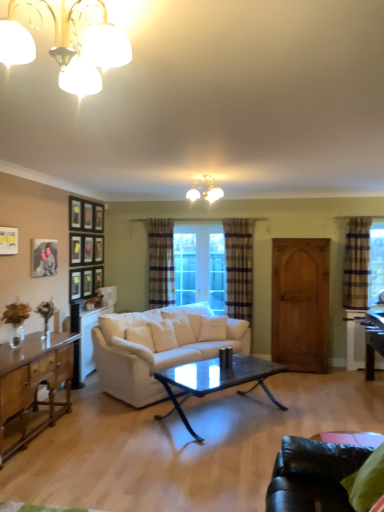
The width and height of the screenshot is (384, 512). What are the coordinates of `wooden cabinet at left` in the screenshot? It's located at click(34, 381).

What do you see at coordinates (300, 304) in the screenshot? I see `wooden armoire at right` at bounding box center [300, 304].

Based on the photo, how much space does matte black picture frame at upper left, which appears as the fourth picture frame when viewed from the front, occupy vertically?

17.60 inches.

Locate an element on the screen. matte black picture frame at upper left, the second picture frame when ordered from right to left is located at coordinates (75, 250).

Locate an element on the screen. The width and height of the screenshot is (384, 512). white fabric pillow at center is located at coordinates (212, 329).

I want to click on plaid fabric curtain at right, which is the third curtain from left to right, so pos(357,264).

The image size is (384, 512). What do you see at coordinates (157, 352) in the screenshot? I see `white fabric couch at center` at bounding box center [157, 352].

Locate an element on the screen. The width and height of the screenshot is (384, 512). wooden cabinet at left is located at coordinates (34, 381).

From the image's perspective, is white fabric pillow at center over white fabric couch at center?

Yes, from the image's perspective, white fabric pillow at center is above white fabric couch at center.

Which object is closer to the camera taking this photo, white fabric pillow at center or white fabric couch at center?

white fabric couch at center is in front.

From a real-world perspective, which is physically below, white fabric pillow at center or white fabric couch at center?

white fabric couch at center is physically lower.

Between white fabric pillow at center and white fabric couch at center, which one has more height?

white fabric couch at center is taller.

In the image, is white fabric couch at center positioned in front of or behind plaid fabric curtain at right, marked as the third curtain in a back-to-front arrangement?

Visually, white fabric couch at center is located in front of plaid fabric curtain at right, marked as the third curtain in a back-to-front arrangement.

Based on the photo, what's the angular difference between white fabric couch at center and plaid fabric curtain at right, which is the third curtain from left to right,'s facing directions?

47.6 degrees separate the facing orientations of white fabric couch at center and plaid fabric curtain at right, which is the third curtain from left to right.

You are a GUI agent. You are given a task and a screenshot of the screen. Output one action in this format:
    pyautogui.click(x=<x>, y=<y>)
    Task: Click on the 1st curtain behind the white fabric couch at center
    The width and height of the screenshot is (384, 512).
    Given the screenshot: What is the action you would take?
    pyautogui.click(x=357, y=264)

From the image's perspective, is white fabric couch at center above or below plaid fabric curtain at right, the first curtain viewed from the right?

Based on their image positions, white fabric couch at center is located beneath plaid fabric curtain at right, the first curtain viewed from the right.

Considering the positions of points (38, 240) and (236, 246), is point (38, 240) closer to camera compared to point (236, 246)?

Yes, it is in front of point (236, 246).

Is matte black picture frame at upper left, the 3th picture frame when ordered from back to front, facing towards plaid fabric curtain at center, placed as the second curtain when sorted from back to front?

No, matte black picture frame at upper left, the 3th picture frame when ordered from back to front, is not facing towards plaid fabric curtain at center, placed as the second curtain when sorted from back to front.

From the image's perspective, between matte black picture frame at upper left, the third picture frame from the right, and plaid fabric curtain at center, placed as the second curtain when sorted from back to front, which one is located above?

From the image's view, matte black picture frame at upper left, the third picture frame from the right, is above.

Considering the relative sizes of matte black picture frame at upper left, the third picture frame from the right, and matte black picture frame at upper left, the 4th picture frame positioned from the right, in the image provided, is matte black picture frame at upper left, the third picture frame from the right, taller than matte black picture frame at upper left, the 4th picture frame positioned from the right,?

Yes, matte black picture frame at upper left, the third picture frame from the right, is taller than matte black picture frame at upper left, the 4th picture frame positioned from the right.

Is matte black picture frame at upper left, the third picture frame from the right, further to camera compared to matte black picture frame at upper left, which appears as the 4th picture frame when viewed from the back?

Yes, it is.

In the scene shown: Which point is more distant from viewer, (48, 248) or (15, 228)?

The point (48, 248) is farther.

I want to click on the 2nd picture frame positioned below the matte black picture frame at upper left, the 4th picture frame positioned from the right (from a real-world perspective), so click(44, 258).

Between plaid fabric curtain at center, which is counted as the second curtain, starting from the front, and black glass coffee table at center, which one has more height?

Standing taller between the two is plaid fabric curtain at center, which is counted as the second curtain, starting from the front.

Could you tell me if plaid fabric curtain at center, placed as the second curtain when sorted from back to front, is facing black glass coffee table at center?

Yes, plaid fabric curtain at center, placed as the second curtain when sorted from back to front, faces towards black glass coffee table at center.

How different are the orientations of plaid fabric curtain at center, which is counted as the second curtain, starting from the front, and black glass coffee table at center in degrees?

50.6 degrees separate the facing orientations of plaid fabric curtain at center, which is counted as the second curtain, starting from the front, and black glass coffee table at center.

Can you confirm if plaid fabric curtain at center, marked as the second curtain in a right-to-left arrangement, is wider than black glass coffee table at center?

Incorrect, the width of plaid fabric curtain at center, marked as the second curtain in a right-to-left arrangement, does not surpass that of black glass coffee table at center.

Is wooden cabinet at left wider or thinner than matte black picture frame at upper left, which appears as the 4th picture frame when viewed from the back?

In the image, wooden cabinet at left appears to be wider than matte black picture frame at upper left, which appears as the 4th picture frame when viewed from the back.

Are wooden cabinet at left and matte black picture frame at upper left, the 1th picture frame from the front, beside each other?

No, wooden cabinet at left is not touching matte black picture frame at upper left, the 1th picture frame from the front.

Does wooden cabinet at left have a greater height compared to matte black picture frame at upper left, the 1th picture frame in the left-to-right sequence?

Correct, wooden cabinet at left is much taller as matte black picture frame at upper left, the 1th picture frame in the left-to-right sequence.

Between point (53, 370) and point (13, 230), which one is positioned in front?

Positioned in front is point (53, 370).

Can you confirm if wooden cabinet at left is wider than black glass coffee table at center?

No.

Would you say wooden cabinet at left is a long distance from black glass coffee table at center?

wooden cabinet at left is positioned a significant distance from black glass coffee table at center.

Is wooden cabinet at left at the right side of black glass coffee table at center?

No.

Does wooden cabinet at left have a larger size compared to black glass coffee table at center?

Indeed, wooden cabinet at left has a larger size compared to black glass coffee table at center.

Image resolution: width=384 pixels, height=512 pixels. What are the coordinates of `studio couch that is in front of the white fabric pillow at center` in the screenshot? It's located at (157, 352).

Identify the location of the 2nd curtain counting from the right side of the white fabric couch at center. (357, 264).

Estimate the real-world distances between objects in this image. Which object is further from plaid fabric curtain at center, which is the 3th curtain from front to back, matte glass chandelier at upper left, which appears as the 1th lamp when viewed from the left, or matte black picture frame at upper left, the 1th picture frame in the left-to-right sequence?

matte glass chandelier at upper left, which appears as the 1th lamp when viewed from the left.

From the picture: Looking at the image, which one is located closer to wooden armoire at right, matte glass chandelier at upper left, the 1th lamp positioned from the front, or matte black picture frame at upper left, the second picture frame positioned from the left?

matte black picture frame at upper left, the second picture frame positioned from the left, is closer to wooden armoire at right.

When comparing their distances from wooden armoire at right, does matte black picture frame at upper left, which is the 3th picture frame in left-to-right order, or white fabric couch at center seem closer?

Among the two, white fabric couch at center is located nearer to wooden armoire at right.

Considering their positions, is wooden picture frame at upper left, which is the second picture frame in back-to-front order, positioned closer to matte white chandelier at upper center, placed as the 2th lamp when sorted from front to back, than wooden cabinet at left?

wooden picture frame at upper left, which is the second picture frame in back-to-front order.

From the image, which object appears to be farther from white fabric couch at center, matte white chandelier at upper center, acting as the 1th lamp starting from the back, or matte black picture frame at upper left, which appears as the 4th picture frame when viewed from the back?

Based on the image, matte black picture frame at upper left, which appears as the 4th picture frame when viewed from the back, appears to be further to white fabric couch at center.

When comparing their distances from matte glass chandelier at upper left, which is the second lamp from right to left, does wooden cabinet at left or white fabric pillow at center seem closer?

Among the two, wooden cabinet at left is located nearer to matte glass chandelier at upper left, which is the second lamp from right to left.

Estimate the real-world distances between objects in this image. Which object is further from wooden cabinet at left, plaid fabric curtain at center, which is the second curtain from left to right, or white fabric pillow at center?

The object further to wooden cabinet at left is plaid fabric curtain at center, which is the second curtain from left to right.

Considering their positions, is white fabric pillow at center positioned closer to plaid fabric curtain at right, the first curtain from the front, than wooden cabinet at left?

white fabric pillow at center.

The image size is (384, 512). I want to click on studio couch between matte black picture frame at upper left, the third picture frame from the right, and wooden armoire at right from left to right, so click(x=157, y=352).

Find the location of `armoire between wooden cabinet at left and plaid fabric curtain at right, which is the third curtain from left to right, in the horizontal direction`. armoire between wooden cabinet at left and plaid fabric curtain at right, which is the third curtain from left to right, in the horizontal direction is located at coordinates (300, 304).

This screenshot has width=384, height=512. I want to click on curtain situated between matte white chandelier at upper center, acting as the 1th lamp starting from the back, and plaid fabric curtain at right, marked as the third curtain in a back-to-front arrangement, from left to right, so click(239, 267).

The image size is (384, 512). Find the location of `studio couch between wooden cabinet at left and plaid fabric curtain at center, which is the second curtain from left to right, along the z-axis`. studio couch between wooden cabinet at left and plaid fabric curtain at center, which is the second curtain from left to right, along the z-axis is located at coordinates (157, 352).